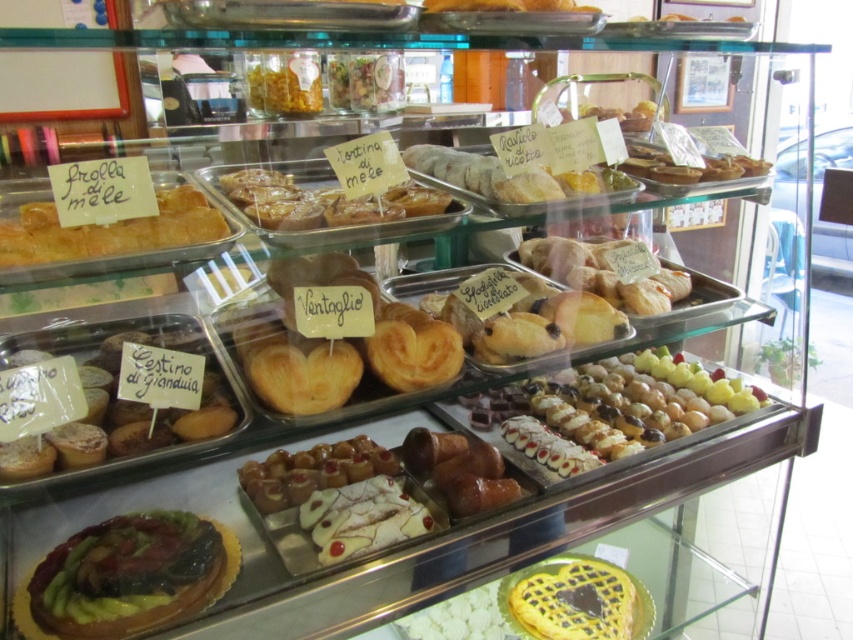
Looking at this image, measure the distance between point (41, 586) and camera.

A distance of 37.94 inches exists between point (41, 586) and camera.

Identify the location of shiny green and red fruit tart at center. (128, 577).

I want to click on shiny green and red fruit tart at center, so click(128, 577).

Is shiny green and red fruit tart at center above glazed pastry at center?

No.

Who is positioned more to the left, shiny green and red fruit tart at center or glazed pastry at center?

shiny green and red fruit tart at center is more to the left.

What do you see at coordinates (128, 577) in the screenshot? I see `shiny green and red fruit tart at center` at bounding box center [128, 577].

You are a GUI agent. You are given a task and a screenshot of the screen. Output one action in this format:
    pyautogui.click(x=<x>, y=<y>)
    Task: Click on the shiny green and red fruit tart at center
    
    Given the screenshot: What is the action you would take?
    pyautogui.click(x=128, y=577)

In the scene shown: Who is positioned more to the right, shiny green and red fruit tart at center or shiny golden pastry at center?

shiny golden pastry at center

In order to click on shiny green and red fruit tart at center in this screenshot , I will do `click(128, 577)`.